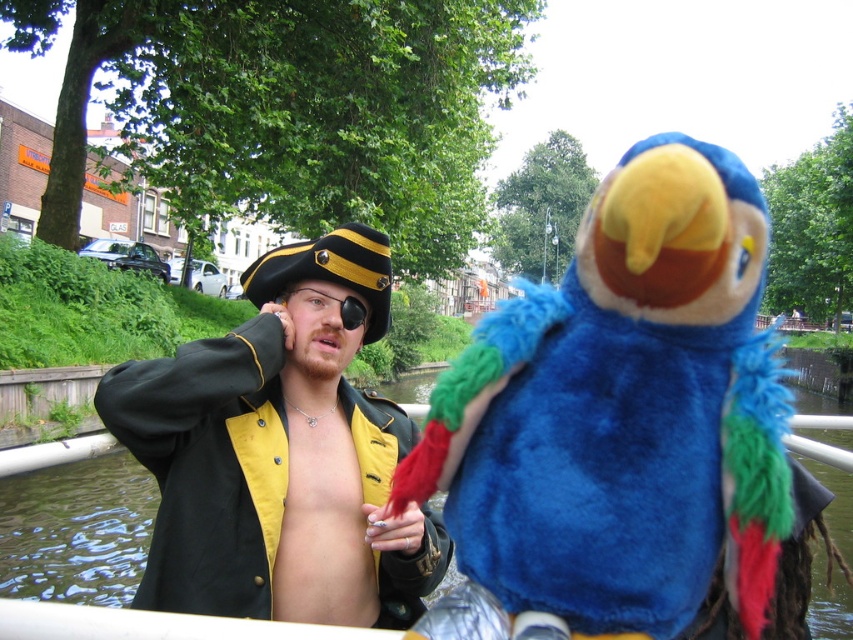
You are a photographer trying to capture the pirate hat in the image. The pirate hat is located at point (280, 452). Can you determine if the pirate hat is positioned above or below the center of the image?

The pirate hat is located at point (280, 452). Since the y coordinate is 0.329, which is below the center point of 0.5, the pirate hat is positioned below the center of the image.